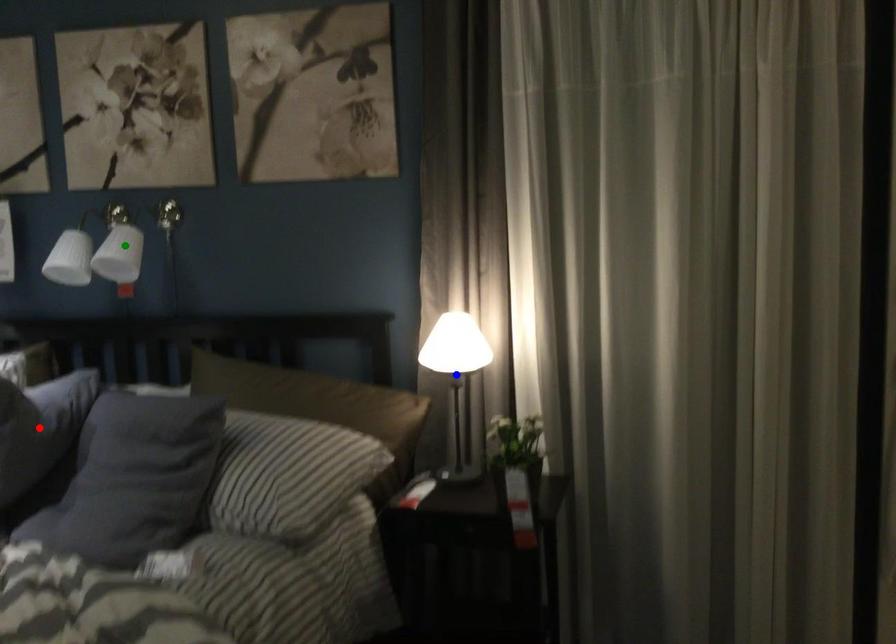
Order these from farthest to nearest:
1. green point
2. blue point
3. red point

green point
blue point
red point